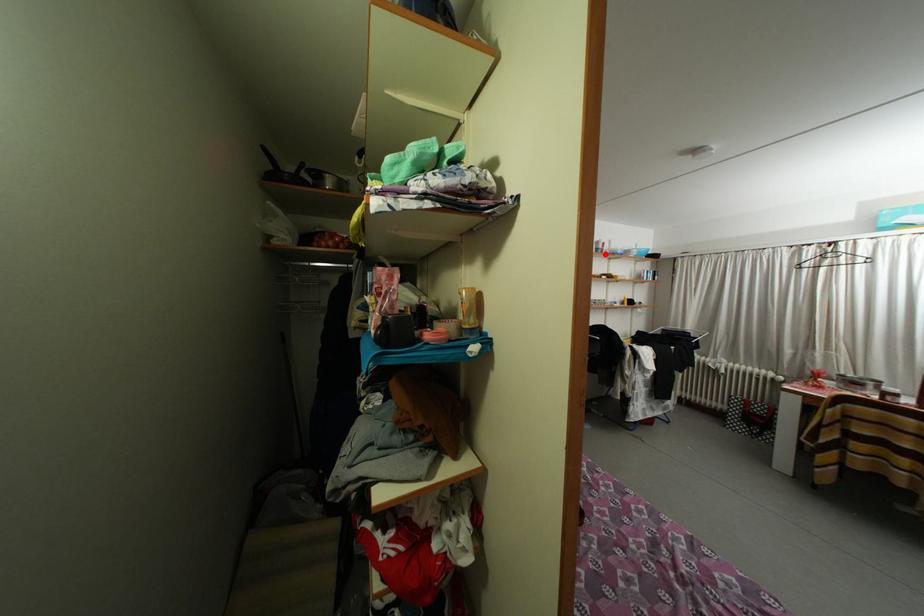
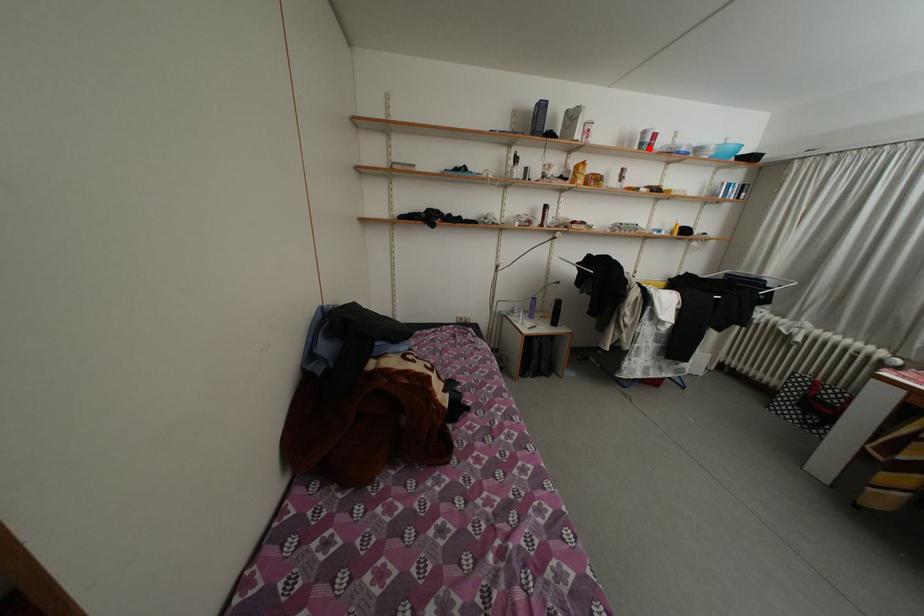
I am providing you with two images of the same scene from different viewpoints. A red point is marked on the first image and another point is marked on the second image. Do the highlighted points in image1 and image2 indicate the same real-world spot?

Yes